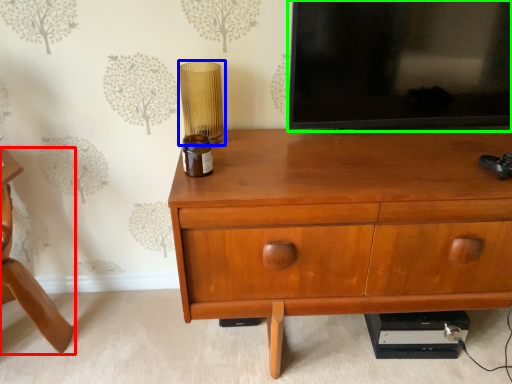
Question: Which object is positioned farthest from furniture (highlighted by a red box)? Select from table lamp (highlighted by a blue box) and television (highlighted by a green box).

Choices:
 (A) table lamp
 (B) television

Answer: (B)